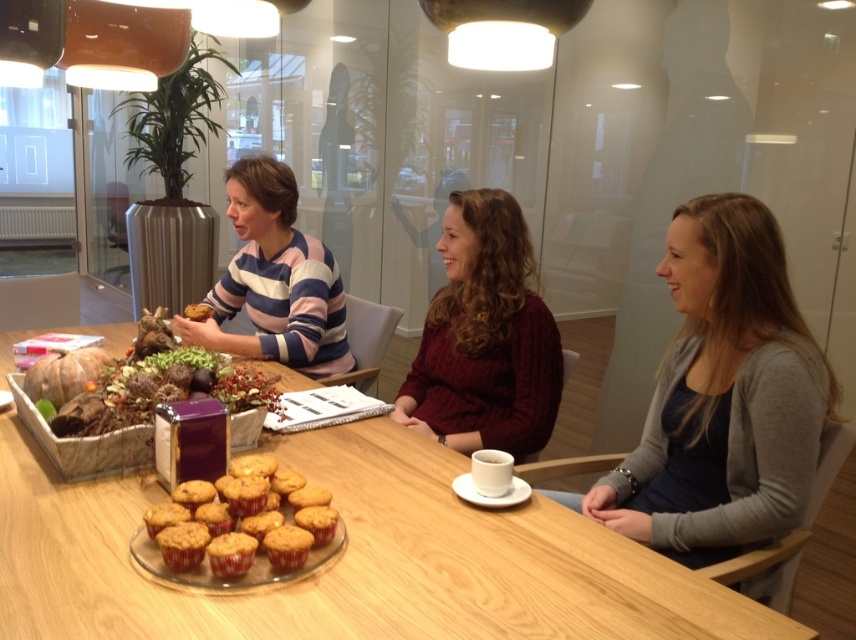
Question: Which point is closer to the camera?

Choices:
 (A) golden crumbly muffins at center
 (B) golden-brown muffin at center

Answer: (A)

Question: Does cable-knit sweater at center have a smaller size compared to golden crumbly muffins at center?

Choices:
 (A) no
 (B) yes

Answer: (A)

Question: Observing the image, what is the correct spatial positioning of wooden table at center in reference to golden crumbly muffin at center?

Choices:
 (A) right
 (B) left

Answer: (A)

Question: Which object is closer to the camera taking this photo?

Choices:
 (A) gray sweater at right
 (B) golden crumbly muffins at center
 (C) white ceramic cup at center
 (D) golden-brown muffin at center

Answer: (B)

Question: Can you confirm if wooden table at center is thinner than golden crumbly muffins at center?

Choices:
 (A) no
 (B) yes

Answer: (A)

Question: Among these points, which one is farthest from the camera?

Choices:
 (A) (509, 481)
 (B) (355, 560)
 (C) (164, 560)

Answer: (A)